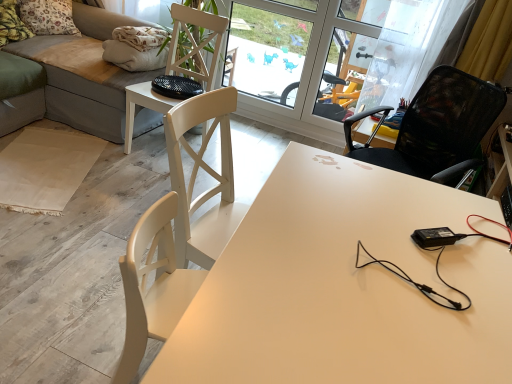
Question: Can you see white wood chair at center, which appears as the second chair when viewed from the right, touching floral fabric pillow at upper left, positioned as the second pillow in front-to-back order?

Choices:
 (A) no
 (B) yes

Answer: (A)

Question: Is floral fabric pillow at upper left, positioned as the second pillow in front-to-back order, located within white wood chair at center, which appears as the second chair when viewed from the right?

Choices:
 (A) yes
 (B) no

Answer: (B)

Question: Can you confirm if white wood chair at center, which appears as the second chair when viewed from the right, is positioned to the left of floral fabric pillow at upper left, which appears as the first pillow when viewed from the back?

Choices:
 (A) yes
 (B) no

Answer: (B)

Question: Is white wood chair at center, which appears as the second chair when viewed from the right, shorter than floral fabric pillow at upper left, which appears as the first pillow when viewed from the back?

Choices:
 (A) no
 (B) yes

Answer: (A)

Question: Is white wood chair at center, which is the first chair in left-to-right order, positioned with its back to floral fabric pillow at upper left, positioned as the second pillow in front-to-back order?

Choices:
 (A) no
 (B) yes

Answer: (A)

Question: Is white wood chair at center, which appears as the second chair when viewed from the right, taller or shorter than floral fabric pillow at upper left, positioned as the second pillow in front-to-back order?

Choices:
 (A) tall
 (B) short

Answer: (A)

Question: From the image's perspective, is white wood chair at center, which appears as the second chair when viewed from the right, above or below floral fabric pillow at upper left, positioned as the second pillow in front-to-back order?

Choices:
 (A) above
 (B) below

Answer: (B)

Question: Would you say white wood chair at center, which appears as the second chair when viewed from the right, is to the left or to the right of floral fabric pillow at upper left, positioned as the second pillow in front-to-back order, in the picture?

Choices:
 (A) left
 (B) right

Answer: (B)

Question: From a real-world perspective, is white wood chair at center, which appears as the second chair when viewed from the right, positioned above or below floral fabric pillow at upper left, positioned as the second pillow in front-to-back order?

Choices:
 (A) below
 (B) above

Answer: (A)

Question: Does point (78, 46) appear closer or farther from the camera than point (253, 100)?

Choices:
 (A) farther
 (B) closer

Answer: (B)

Question: In the image, is velvet grey couch at upper left positioned in front of or behind transparent glass screen door at upper center?

Choices:
 (A) front
 (B) behind

Answer: (A)

Question: Is velvet grey couch at upper left taller or shorter than transparent glass screen door at upper center?

Choices:
 (A) tall
 (B) short

Answer: (B)

Question: From the image's perspective, relative to transparent glass screen door at upper center, is velvet grey couch at upper left above or below?

Choices:
 (A) above
 (B) below

Answer: (B)

Question: From the image's perspective, is white matte desk at center above or below fluffy fabric pillow at upper left, positioned as the first pillow in front-to-back order?

Choices:
 (A) above
 (B) below

Answer: (B)

Question: Is white matte desk at center wider or thinner than fluffy fabric pillow at upper left, positioned as the first pillow in front-to-back order?

Choices:
 (A) thin
 (B) wide

Answer: (B)